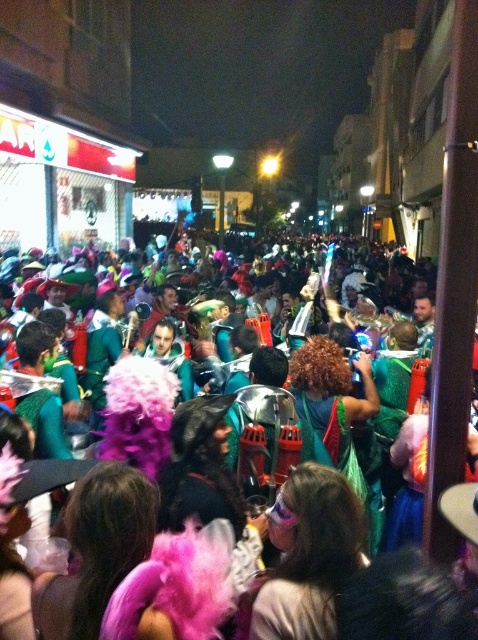
Which of these two, fuzzy pink boa at center or shiny pink wig at center, stands taller?

With more height is fuzzy pink boa at center.

Who is shorter, fuzzy pink boa at center or shiny pink wig at center?

Standing shorter between the two is shiny pink wig at center.

Between point (248, 276) and point (258, 611), which one is positioned in front?

Point (258, 611) is more forward.

Identify the location of fuzzy pink boa at center. The width and height of the screenshot is (478, 640). (356, 380).